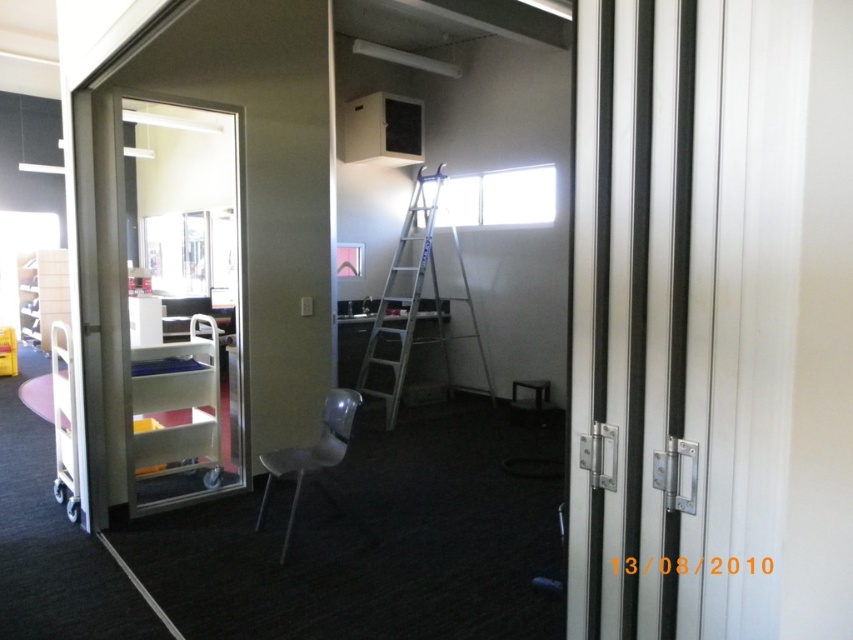
Does metallic silver cart at left appear over silver metallic ladder at center?

Incorrect, metallic silver cart at left is not positioned above silver metallic ladder at center.

Is point (143, 384) in front of point (396, 403)?

Yes, it is.

You are a GUI agent. You are given a task and a screenshot of the screen. Output one action in this format:
    pyautogui.click(x=<x>, y=<y>)
    Task: Click on the metallic silver cart at left
    
    Given the screenshot: What is the action you would take?
    pyautogui.click(x=178, y=404)

Where is `silver metallic ladder at center`? Image resolution: width=853 pixels, height=640 pixels. silver metallic ladder at center is located at coordinates (404, 296).

You are a GUI agent. You are given a task and a screenshot of the screen. Output one action in this format:
    pyautogui.click(x=<x>, y=<y>)
    Task: Click on the silver metallic ladder at center
    This screenshot has height=640, width=853.
    Given the screenshot: What is the action you would take?
    pyautogui.click(x=404, y=296)

Locate an element on the screen. The width and height of the screenshot is (853, 640). silver metallic ladder at center is located at coordinates (404, 296).

Between metallic silver cart at left and matte gray chair at center, which one appears on the left side from the viewer's perspective?

Positioned to the left is metallic silver cart at left.

From the picture: Does metallic silver cart at left appear under matte gray chair at center?

Actually, metallic silver cart at left is above matte gray chair at center.

Does point (167, 412) come closer to viewer compared to point (265, 513)?

No, (167, 412) is further to viewer.

The height and width of the screenshot is (640, 853). In order to click on metallic silver cart at left in this screenshot , I will do `click(178, 404)`.